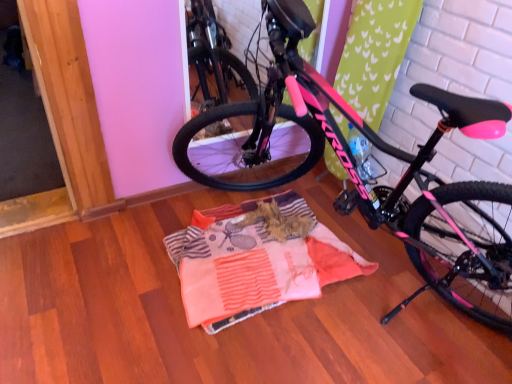
At what (x,y) coordinates should I click in order to perform the action: click on vacant space to the right of striped cotton blanket at center. Please return your answer as a coordinate pair (x, y). Looking at the image, I should click on coord(401,300).